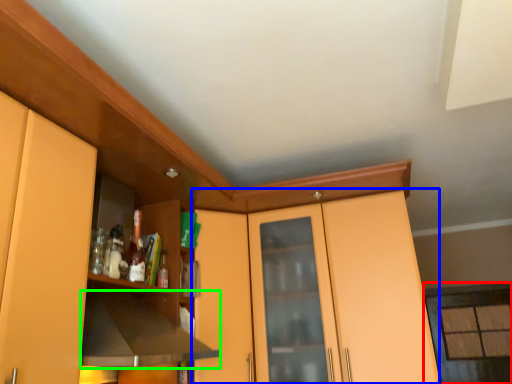
Question: Which is farther away from window (highlighted by a red box)? dresser (highlighted by a blue box) or exhaust hood (highlighted by a green box)?

Choices:
 (A) dresser
 (B) exhaust hood

Answer: (B)